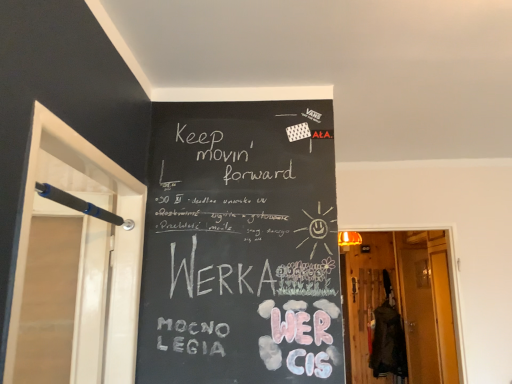
Describe the element at coordinates (418, 315) in the screenshot. I see `translucent glass screen door at right, which ranks as the 2th screen door in top-to-bottom order` at that location.

Image resolution: width=512 pixels, height=384 pixels. What do you see at coordinates (86, 250) in the screenshot? I see `black plastic screen door at left, positioned as the first screen door in top-to-bottom order` at bounding box center [86, 250].

Locate an element on the screen. This screenshot has height=384, width=512. translucent glass screen door at right, the first screen door positioned from the bottom is located at coordinates (418, 315).

In the scene shown: Can you tell me how much translucent glass screen door at right, the 1th screen door positioned from the back, and black plastic screen door at left, the 1th screen door when ordered from left to right, differ in facing direction?

80.6 degrees separate the facing orientations of translucent glass screen door at right, the 1th screen door positioned from the back, and black plastic screen door at left, the 1th screen door when ordered from left to right.

Could you tell me if translucent glass screen door at right, acting as the second screen door starting from the left, is facing black plastic screen door at left, the 1th screen door when ordered from left to right?

No, translucent glass screen door at right, acting as the second screen door starting from the left, is not turned towards black plastic screen door at left, the 1th screen door when ordered from left to right.

Is black plastic screen door at left, the 1th screen door when ordered from left to right, located within translucent glass screen door at right, acting as the second screen door starting from the left?

No, black plastic screen door at left, the 1th screen door when ordered from left to right, is not surrounded by translucent glass screen door at right, acting as the second screen door starting from the left.

From a real-world perspective, is translucent glass screen door at right, the first screen door positioned from the bottom, located higher than black plastic screen door at left, positioned as the first screen door in top-to-bottom order?

No.

Is wooden door at center located within translucent glass screen door at right, the first screen door positioned from the bottom?

No.

Based on their sizes in the image, would you say translucent glass screen door at right, the first screen door positioned from the bottom, is bigger or smaller than wooden door at center?

translucent glass screen door at right, the first screen door positioned from the bottom, is smaller than wooden door at center.

Does translucent glass screen door at right, the 1th screen door positioned from the back, touch wooden door at center?

translucent glass screen door at right, the 1th screen door positioned from the back, and wooden door at center are not in contact.

In order to click on door that is in front of the translucent glass screen door at right, acting as the second screen door starting from the left in this screenshot , I will do `click(399, 307)`.

Does wooden door at center have a greater width compared to translucent glass screen door at right, acting as the second screen door starting from the left?

Yes, wooden door at center is wider than translucent glass screen door at right, acting as the second screen door starting from the left.

Which of these two, wooden door at center or translucent glass screen door at right, acting as the second screen door starting from the left, is smaller?

Smaller between the two is translucent glass screen door at right, acting as the second screen door starting from the left.

Which of these two, wooden door at center or translucent glass screen door at right, acting as the second screen door starting from the left, stands shorter?

wooden door at center is shorter.

Can we say wooden door at center lies outside translucent glass screen door at right, acting as the second screen door starting from the left?

wooden door at center is positioned outside translucent glass screen door at right, acting as the second screen door starting from the left.

Considering the sizes of objects black plastic screen door at left, the 1th screen door when ordered from left to right, and translucent glass screen door at right, the first screen door positioned from the bottom, in the image provided, who is wider, black plastic screen door at left, the 1th screen door when ordered from left to right, or translucent glass screen door at right, the first screen door positioned from the bottom,?

Wider between the two is black plastic screen door at left, the 1th screen door when ordered from left to right.

Is point (126, 270) closer to camera compared to point (398, 265)?

Yes.

Does black plastic screen door at left, placed as the second screen door when sorted from back to front, appear on the right side of translucent glass screen door at right, which appears as the first screen door when viewed from the right?

No, black plastic screen door at left, placed as the second screen door when sorted from back to front, is not to the right of translucent glass screen door at right, which appears as the first screen door when viewed from the right.

From the image's perspective, is black plastic screen door at left, placed as the second screen door when sorted from back to front, located above translucent glass screen door at right, which ranks as the 2th screen door in top-to-bottom order?

Yes, from the image's perspective, black plastic screen door at left, placed as the second screen door when sorted from back to front, is over translucent glass screen door at right, which ranks as the 2th screen door in top-to-bottom order.

Which of these two, black plastic screen door at left, positioned as the first screen door in top-to-bottom order, or wooden door at center, is bigger?

black plastic screen door at left, positioned as the first screen door in top-to-bottom order, is bigger.

Does point (130, 365) come closer to viewer compared to point (401, 368)?

Yes, point (130, 365) is closer to viewer.

Visually, is black plastic screen door at left, positioned as the first screen door in top-to-bottom order, positioned to the left or to the right of wooden door at center?

Answer: black plastic screen door at left, positioned as the first screen door in top-to-bottom order, is to the left of wooden door at center.

From a real-world perspective, is wooden door at center on black plastic screen door at left, the second screen door viewed from the right?

No, from a real-world perspective, wooden door at center is not above black plastic screen door at left, the second screen door viewed from the right.

Can you tell me how much wooden door at center and black plastic screen door at left, which appears as the 2th screen door when ordered from the bottom, differ in facing direction?

wooden door at center and black plastic screen door at left, which appears as the 2th screen door when ordered from the bottom, are facing 91.6 degrees away from each other.

Which is correct: wooden door at center is inside black plastic screen door at left, the 1th screen door from the front, or outside of it?

wooden door at center is not inside black plastic screen door at left, the 1th screen door from the front, it's outside.

From the image's perspective, relative to black plastic screen door at left, positioned as the first screen door in top-to-bottom order, is wooden door at center above or below?

Based on their image positions, wooden door at center is located beneath black plastic screen door at left, positioned as the first screen door in top-to-bottom order.

Where is `screen door on the right of black plastic screen door at left, the 1th screen door from the front`? This screenshot has width=512, height=384. screen door on the right of black plastic screen door at left, the 1th screen door from the front is located at coordinates (418, 315).

Locate an element on the screen. screen door directly beneath the wooden door at center (from a real-world perspective) is located at coordinates (418, 315).

Based on their spatial positions, is black plastic screen door at left, positioned as the first screen door in top-to-bottom order, or translucent glass screen door at right, the second screen door when ordered from front to back, further from wooden door at center?

black plastic screen door at left, positioned as the first screen door in top-to-bottom order.

Considering their positions, is translucent glass screen door at right, which ranks as the 2th screen door in top-to-bottom order, positioned closer to black plastic screen door at left, the 1th screen door from the front, than wooden door at center?

wooden door at center is closer to black plastic screen door at left, the 1th screen door from the front.

From the image, which object appears to be nearer to wooden door at center, translucent glass screen door at right, the first screen door positioned from the bottom, or black plastic screen door at left, placed as the second screen door when sorted from back to front?

translucent glass screen door at right, the first screen door positioned from the bottom, is positioned closer to the anchor wooden door at center.

Estimate the real-world distances between objects in this image. Which object is closer to translucent glass screen door at right, the first screen door positioned from the bottom, black plastic screen door at left, positioned as the first screen door in top-to-bottom order, or wooden door at center?

wooden door at center lies closer to translucent glass screen door at right, the first screen door positioned from the bottom, than the other object.

Which object lies nearer to the anchor point translucent glass screen door at right, the 1th screen door positioned from the back, wooden door at center or black plastic screen door at left, placed as the second screen door when sorted from back to front?

wooden door at center.

When comparing their distances from black plastic screen door at left, which appears as the 2th screen door when ordered from the bottom, does wooden door at center or translucent glass screen door at right, which appears as the first screen door when viewed from the right, seem further?

Based on the image, translucent glass screen door at right, which appears as the first screen door when viewed from the right, appears to be further to black plastic screen door at left, which appears as the 2th screen door when ordered from the bottom.

At what (x,y) coordinates should I click in order to perform the action: click on door located between black plastic screen door at left, the 1th screen door when ordered from left to right, and translucent glass screen door at right, the first screen door positioned from the bottom, in the depth direction. Please return your answer as a coordinate pair (x, y). This screenshot has width=512, height=384. Looking at the image, I should click on tap(399, 307).